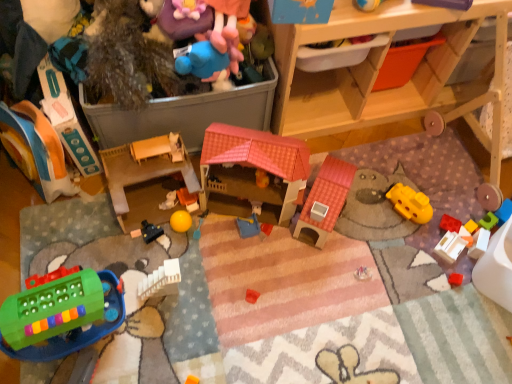
This screenshot has height=384, width=512. I want to click on free space between translucent orange cube at center, which ranks as the eleventh toy in left-to-right order, and green plastic building block at lower left, positioned as the 11th toy in right-to-left order, so click(276, 286).